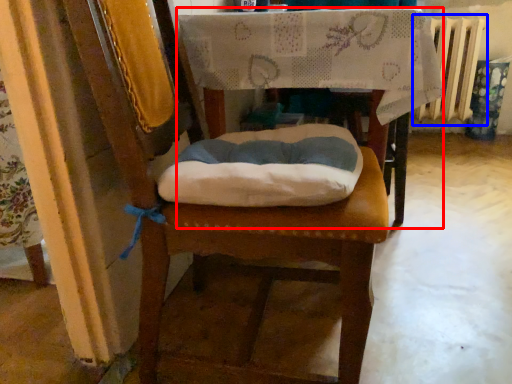
Question: Among these objects, which one is farthest to the camera, table (highlighted by a red box) or radiator (highlighted by a blue box)?

Choices:
 (A) table
 (B) radiator

Answer: (B)